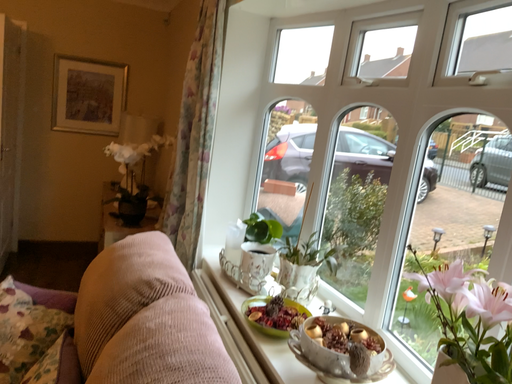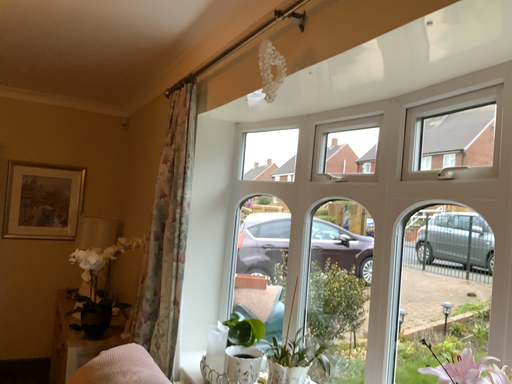
Question: Which way did the camera rotate in the video?

Choices:
 (A) rotated left
 (B) rotated right

Answer: (B)